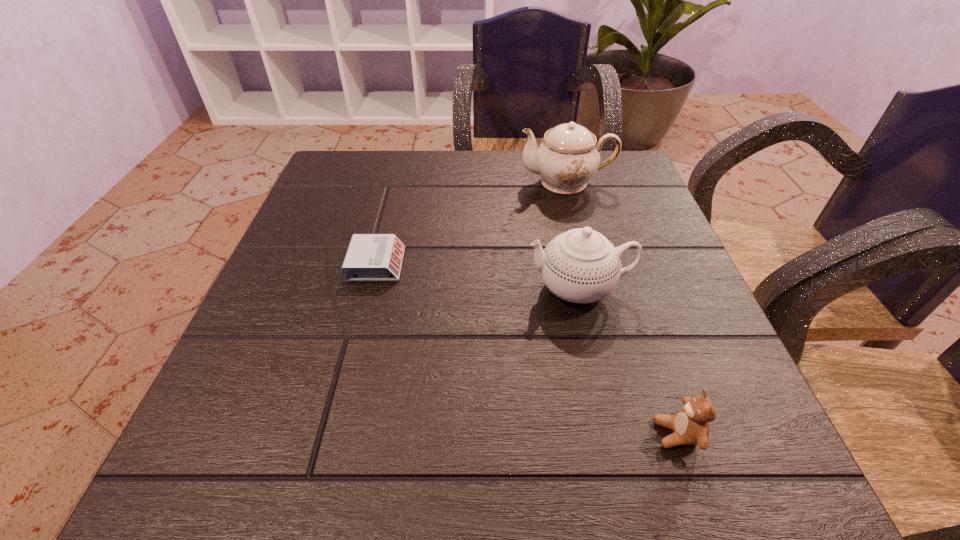
Locate an element on the screen. The width and height of the screenshot is (960, 540). object located in the far right corner section of the desktop is located at coordinates (568, 157).

At what (x,y) coordinates should I click in order to perform the action: click on object present at the near right corner. Please return your answer as a coordinate pair (x, y). The image size is (960, 540). Looking at the image, I should click on (690, 425).

Find the location of `vacant space at the far edge of the desktop`. vacant space at the far edge of the desktop is located at coordinates (411, 191).

Find the location of `free space at the near edge`. free space at the near edge is located at coordinates (540, 447).

You are a GUI agent. You are given a task and a screenshot of the screen. Output one action in this format:
    pyautogui.click(x=<x>, y=<y>)
    Task: Click on the vacant space at the left edge
    This screenshot has height=540, width=960.
    Given the screenshot: What is the action you would take?
    pyautogui.click(x=291, y=263)

This screenshot has height=540, width=960. Find the location of `free space at the right edge of the desktop`. free space at the right edge of the desktop is located at coordinates (691, 310).

What are the coordinates of `free space at the far left corner of the desktop` in the screenshot? It's located at (332, 198).

This screenshot has width=960, height=540. In the image, there is a desktop. In order to click on free region at the near right corner in this screenshot , I will do `click(748, 451)`.

You are a GUI agent. You are given a task and a screenshot of the screen. Output one action in this format:
    pyautogui.click(x=<x>, y=<y>)
    Task: Click on the vacant area between the shortest object and the third tallest object
    The height and width of the screenshot is (540, 960).
    Given the screenshot: What is the action you would take?
    pyautogui.click(x=527, y=349)

Where is `free space that is in between the nearer chinaware and the second shortest object`? The width and height of the screenshot is (960, 540). free space that is in between the nearer chinaware and the second shortest object is located at coordinates (628, 361).